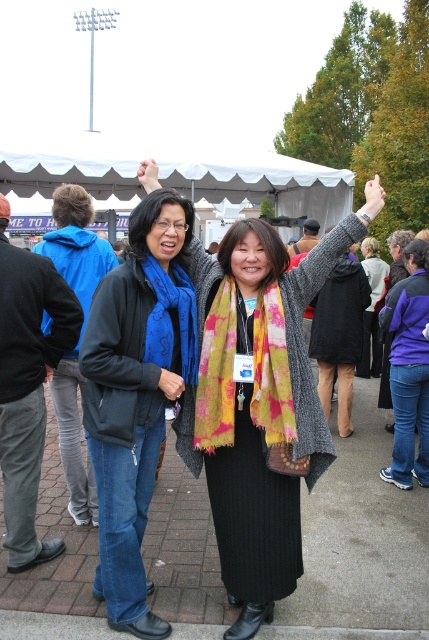
Question: Which object appears farthest from the camera in this image?

Choices:
 (A) multicolored scarf at center
 (B) white fabric canopy at upper center
 (C) tie-dye wool scarf at center

Answer: (B)

Question: Which point appears closest to the camera in this image?

Choices:
 (A) (141, 157)
 (B) (154, 275)
 (C) (172, 337)
 (D) (278, 532)

Answer: (B)

Question: Does blue fleece jacket at center appear on the left side of white fabric canopy at upper center?

Choices:
 (A) yes
 (B) no

Answer: (B)

Question: Which of the following is the closest to the observer?

Choices:
 (A) blue fleece jacket at center
 (B) white fabric canopy at upper center

Answer: (A)

Question: Can you confirm if multicolored scarf at center is positioned to the right of blue fleece jacket at center?

Choices:
 (A) no
 (B) yes

Answer: (B)

Question: Can you confirm if multicolored scarf at center is positioned below white fabric canopy at upper center?

Choices:
 (A) no
 (B) yes

Answer: (B)